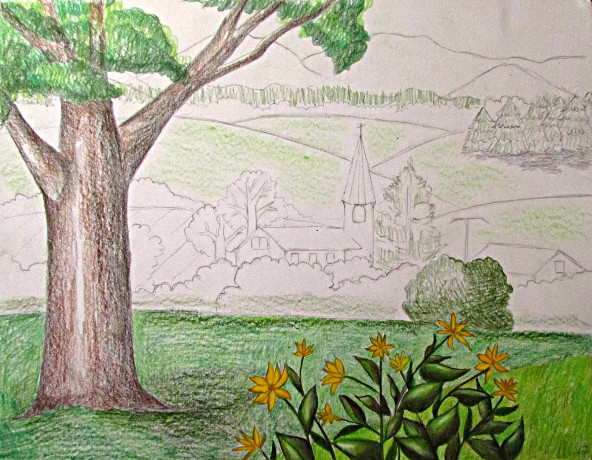
Image resolution: width=592 pixels, height=460 pixels. I want to click on windows, so click(x=559, y=265), click(x=262, y=240), click(x=294, y=257), click(x=310, y=256), click(x=330, y=258).